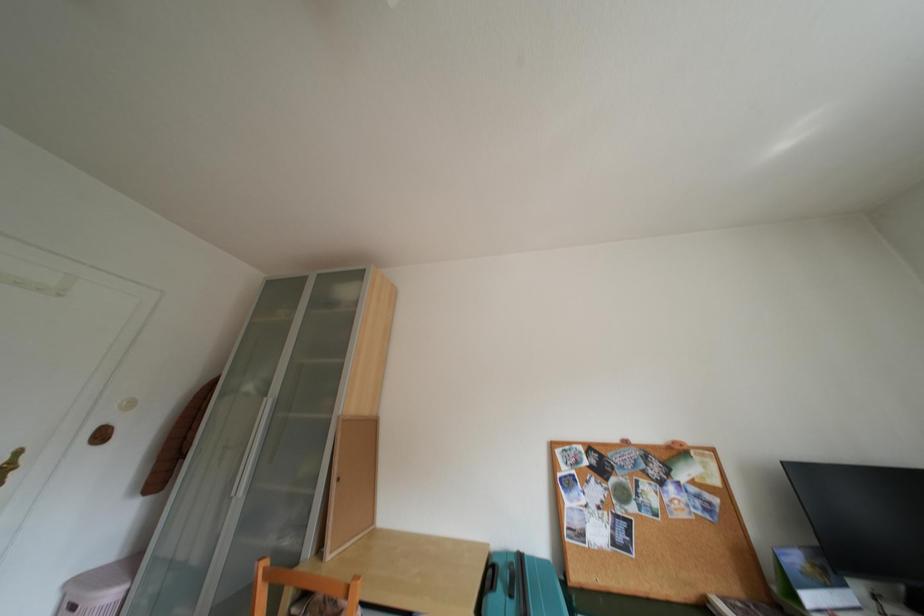
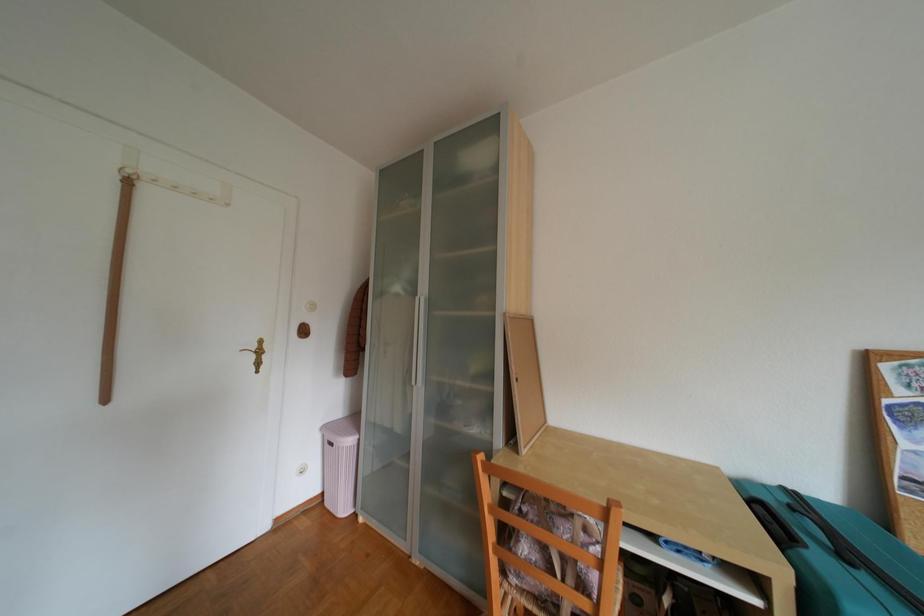
Based on the photo, the images are taken continuously from a first-person perspective. In which direction are you moving?

The cameraman walked toward left, forward.